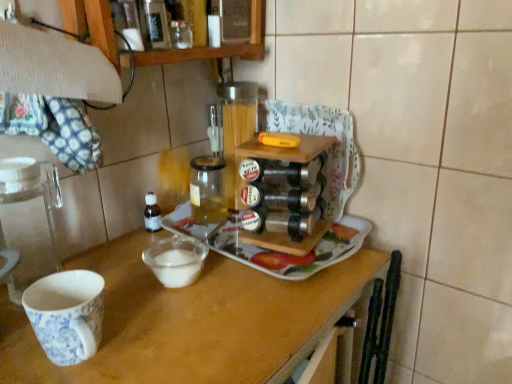
Where is `porcelain cup at left`? The width and height of the screenshot is (512, 384). porcelain cup at left is located at coordinates (29, 220).

What is the approximate width of wooden shelf at upper left?

It is 6.85 inches.

At what (x,y) coordinates should I click in order to perform the action: click on wooden table at center. Please return your answer as a coordinate pair (x, y). Image resolution: width=512 pixels, height=384 pixels. Looking at the image, I should click on (192, 321).

The height and width of the screenshot is (384, 512). Find the location of `porcelain cup at left`. porcelain cup at left is located at coordinates (29, 220).

Identify the location of appliance on the left side of translucent glass jar at center. (29, 220).

Looking at their sizes, would you say porcelain cup at left is wider or thinner than translucent glass jar at center?

In the image, porcelain cup at left appears to be wider than translucent glass jar at center.

Would you say porcelain cup at left is to the left or to the right of translucent glass jar at center in the picture?

Clearly, porcelain cup at left is on the left of translucent glass jar at center in the image.

Is porcelain cup at left looking in the opposite direction of translucent glass jar at center?

No, translucent glass jar at center is not at the back of porcelain cup at left.

Does white ceramic tray at center have a greater width compared to wooden table at center?

No.

From the image's perspective, is white ceramic tray at center beneath wooden table at center?

Incorrect, from the image's perspective, white ceramic tray at center is higher than wooden table at center.

From a real-world perspective, is white ceramic tray at center below wooden table at center?

No, from a real-world perspective, white ceramic tray at center is not beneath wooden table at center.

Based on the photo, can you tell me how much white ceramic tray at center and wooden table at center differ in facing direction?

The angular difference between white ceramic tray at center and wooden table at center is 0.247 degrees.

How far apart are porcelain cup at left and wooden table at center?

They are 10.29 inches apart.

How different are the orientations of porcelain cup at left and wooden table at center in degrees?

They differ by 0.171 degrees in their facing directions.

Locate an element on the screen. The height and width of the screenshot is (384, 512). appliance positioned vertically above the wooden table at center (from a real-world perspective) is located at coordinates (29, 220).

Is the position of porcelain cup at left more distant than that of wooden table at center?

Yes, porcelain cup at left is further from the viewer.

Considering the relative sizes of white ceramic tray at center and wooden shelf at upper left in the image provided, is white ceramic tray at center thinner than wooden shelf at upper left?

No, white ceramic tray at center is not thinner than wooden shelf at upper left.

Considering the sizes of objects white ceramic tray at center and wooden shelf at upper left in the image provided, who is shorter, white ceramic tray at center or wooden shelf at upper left?

With less height is white ceramic tray at center.

Considering the positions of objects white ceramic tray at center and wooden shelf at upper left in the image provided, who is behind, white ceramic tray at center or wooden shelf at upper left?

white ceramic tray at center is behind.

From the picture: Would you say wooden shelf at upper left is part of white ceramic tray at center's contents?

No, white ceramic tray at center does not contain wooden shelf at upper left.

Measure the distance between wooden shelf at upper left and porcelain cup at left.

wooden shelf at upper left is 13.63 inches away from porcelain cup at left.

Between wooden shelf at upper left and porcelain cup at left, which one appears on the left side from the viewer's perspective?

Positioned to the left is porcelain cup at left.

How many degrees apart are the facing directions of wooden shelf at upper left and porcelain cup at left?

0.461 degrees separate the facing orientations of wooden shelf at upper left and porcelain cup at left.

Would you say wooden shelf at upper left contains porcelain cup at left?

That's incorrect, porcelain cup at left is not inside wooden shelf at upper left.

Can you confirm if white ceramic tray at center is wider than porcelain cup at left?

Indeed, white ceramic tray at center has a greater width compared to porcelain cup at left.

Which of these two, white ceramic tray at center or porcelain cup at left, stands shorter?

white ceramic tray at center is shorter.

Is white ceramic tray at center located outside porcelain cup at left?

white ceramic tray at center is positioned outside porcelain cup at left.

Which is closer to the camera, [228,226] or [41,163]?

Clearly, point [228,226] is more distant from the camera than point [41,163].

Can you see porcelain cup at left touching white ceramic tray at center?

porcelain cup at left is not next to white ceramic tray at center, and they're not touching.

Is porcelain cup at left oriented towards white ceramic tray at center?

No, porcelain cup at left does not turn towards white ceramic tray at center.

Does point (54, 191) come closer to viewer compared to point (344, 221)?

That is True.

Does porcelain cup at left have a greater height compared to white ceramic tray at center?

Indeed, porcelain cup at left has a greater height compared to white ceramic tray at center.

The image size is (512, 384). Find the location of `beverage above the porcelain cup at left (from a real-world perspective)`. beverage above the porcelain cup at left (from a real-world perspective) is located at coordinates (208, 189).

Find the location of a particular element. table beneath the white ceramic tray at center (from a real-world perspective) is located at coordinates (192, 321).

When comparing their distances from white ceramic tray at center, does translucent glass jar at center or porcelain cup at left seem closer?

translucent glass jar at center is closer to white ceramic tray at center.

Which object lies further to the anchor point translucent glass jar at center, porcelain cup at left or wooden shelf at upper left?

Among the two, porcelain cup at left is located further to translucent glass jar at center.

Considering their positions, is porcelain cup at left positioned further to wooden table at center than white ceramic tray at center?

porcelain cup at left.

Based on their spatial positions, is white ceramic tray at center or porcelain cup at left closer to wooden shelf at upper left?

porcelain cup at left lies closer to wooden shelf at upper left than the other object.

From the image, which object appears to be nearer to white ceramic tray at center, wooden table at center or wooden shelf at upper left?

Among the two, wooden table at center is located nearer to white ceramic tray at center.

In the scene shown: Considering their positions, is translucent glass jar at center positioned closer to porcelain cup at left than wooden table at center?

wooden table at center lies closer to porcelain cup at left than the other object.

When comparing their distances from white ceramic tray at center, does wooden table at center or porcelain cup at left seem closer?

The object closer to white ceramic tray at center is wooden table at center.

When comparing their distances from wooden shelf at upper left, does wooden table at center or porcelain cup at left seem closer?

porcelain cup at left lies closer to wooden shelf at upper left than the other object.

You are a GUI agent. You are given a task and a screenshot of the screen. Output one action in this format:
    pyautogui.click(x=<x>, y=<y>)
    Task: Click on the tray between wooden table at center and translucent glass jar at center from front to back
    
    Given the screenshot: What is the action you would take?
    pyautogui.click(x=270, y=250)

Locate an element on the screen. The height and width of the screenshot is (384, 512). appliance between white ceramic tray at center and wooden table at center vertically is located at coordinates (29, 220).

Find the location of a particular element. beverage between wooden shelf at upper left and porcelain cup at left in the up-down direction is located at coordinates (208, 189).

Find the location of `appliance between wooden shelf at upper left and wooden table at center in the vertical direction`. appliance between wooden shelf at upper left and wooden table at center in the vertical direction is located at coordinates (29, 220).